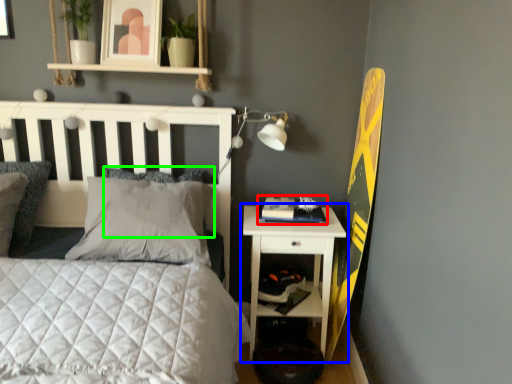
Question: Based on their relative distances, which object is nearer to book (highlighted by a red box)? Choose from nightstand (highlighted by a blue box) and pillow (highlighted by a green box).

Choices:
 (A) nightstand
 (B) pillow

Answer: (A)